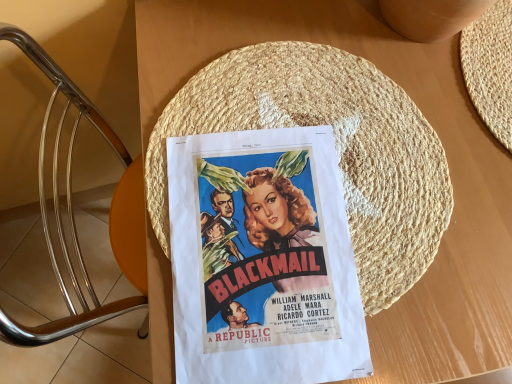
Question: Does matte paper poster at center have a greater height compared to natural straw hat at center?

Choices:
 (A) yes
 (B) no

Answer: (B)

Question: From the image's perspective, is matte paper poster at center on top of natural straw hat at center?

Choices:
 (A) yes
 (B) no

Answer: (B)

Question: Is the depth of matte paper poster at center greater than that of natural straw hat at center?

Choices:
 (A) no
 (B) yes

Answer: (A)

Question: Is natural straw hat at center located within matte paper poster at center?

Choices:
 (A) yes
 (B) no

Answer: (A)

Question: Does matte paper poster at center turn towards natural straw hat at center?

Choices:
 (A) no
 (B) yes

Answer: (B)

Question: Can you confirm if matte paper poster at center is positioned to the left of natural straw hat at center?

Choices:
 (A) no
 (B) yes

Answer: (B)

Question: Can you confirm if natural straw hat at center is thinner than matte paper poster at center?

Choices:
 (A) no
 (B) yes

Answer: (A)

Question: Can we say natural straw hat at center lies outside matte paper poster at center?

Choices:
 (A) yes
 (B) no

Answer: (B)

Question: Is natural straw hat at center aimed at matte paper poster at center?

Choices:
 (A) no
 (B) yes

Answer: (B)

Question: From a real-world perspective, is natural straw hat at center below matte paper poster at center?

Choices:
 (A) no
 (B) yes

Answer: (B)

Question: Is natural straw hat at center directly adjacent to matte paper poster at center?

Choices:
 (A) no
 (B) yes

Answer: (B)

Question: Does natural straw hat at center have a greater width compared to matte paper poster at center?

Choices:
 (A) yes
 (B) no

Answer: (A)

Question: From the image's perspective, is matte paper poster at center located above or below natural straw hat at center?

Choices:
 (A) below
 (B) above

Answer: (A)